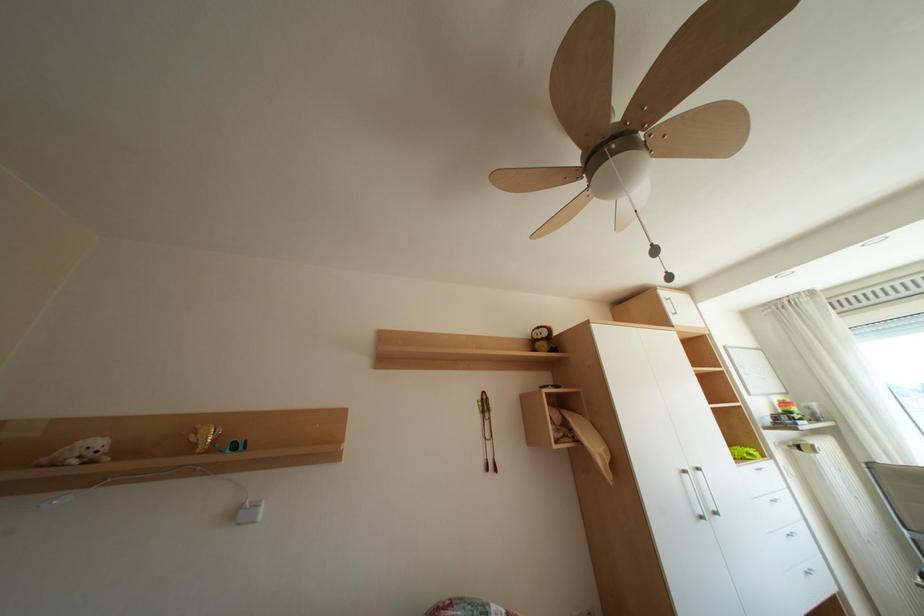
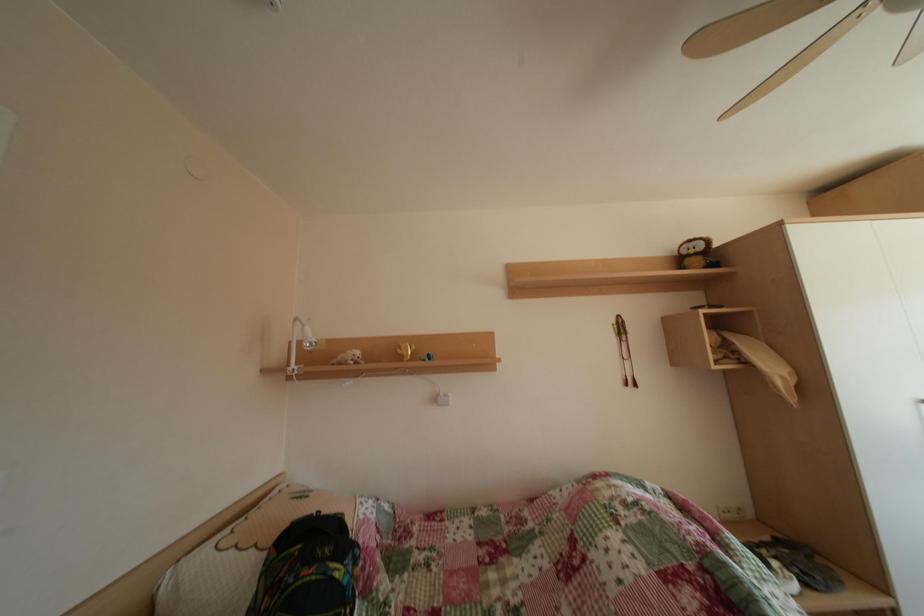
Question: The first image is from the beginning of the video and the second image is from the end. How did the camera likely rotate when shooting the video?

Choices:
 (A) Left
 (B) Right
 (C) Up
 (D) Down

Answer: (A)